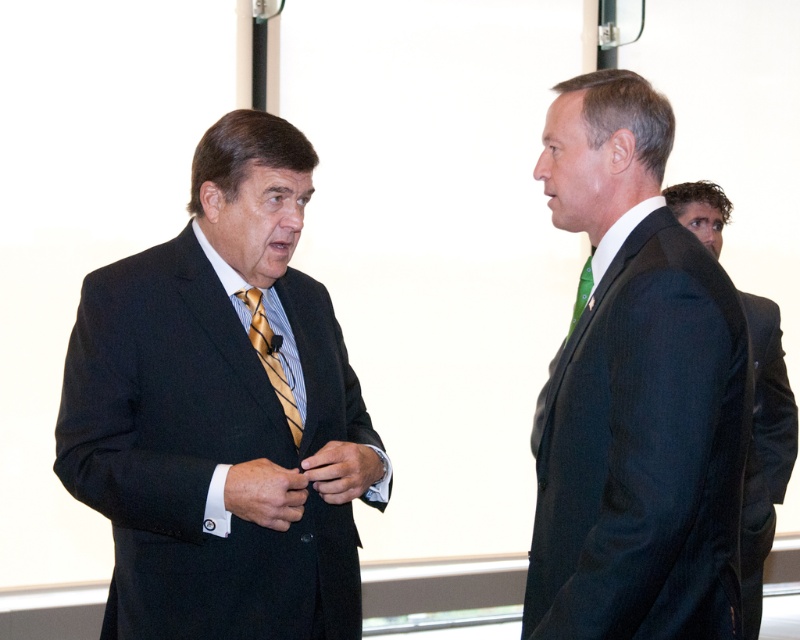
You are organizing a charity event and need to ensure that all donated items fit into a storage box. The storage box has a height limit of 1 meter. You have two items to store temporarily. One is the dark green suit at right and the other is the yellow striped tie at left. Based on the image, will both items fit vertically in the box when placed side by side?

The dark green suit at right is bigger than the yellow striped tie at left. Since the storage box has a height limit of 1 meter, the dark green suit at right may exceed the height limit when placed vertically. Therefore, it might not fit properly in the box along with the yellow striped tie at left.

You are standing in the room where the two men are talking. You need to place a small table between the two points labeled point (760, 556) and point (584, 264). Which point should the table be closer to if it needs to be placed closer to the man who is speaking?

The table should be placed closer to point (760, 556) because it is in front of point (584, 264), and the man speaking is likely positioned there.

Based on the photo, you are a tailor observing the two men in the scene. You need to determine which item requires more fabric for alterations between the dark gray suit at right and the green silk tie at right. Based on their sizes, which one would need more fabric?

The dark gray suit at right requires more fabric for alterations since its width is larger than the green silk tie at right.